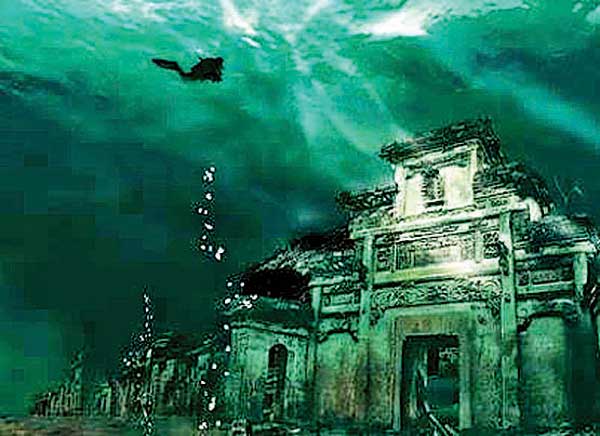
The width and height of the screenshot is (600, 436). Identify the location of open arch. (279, 352), (419, 351).